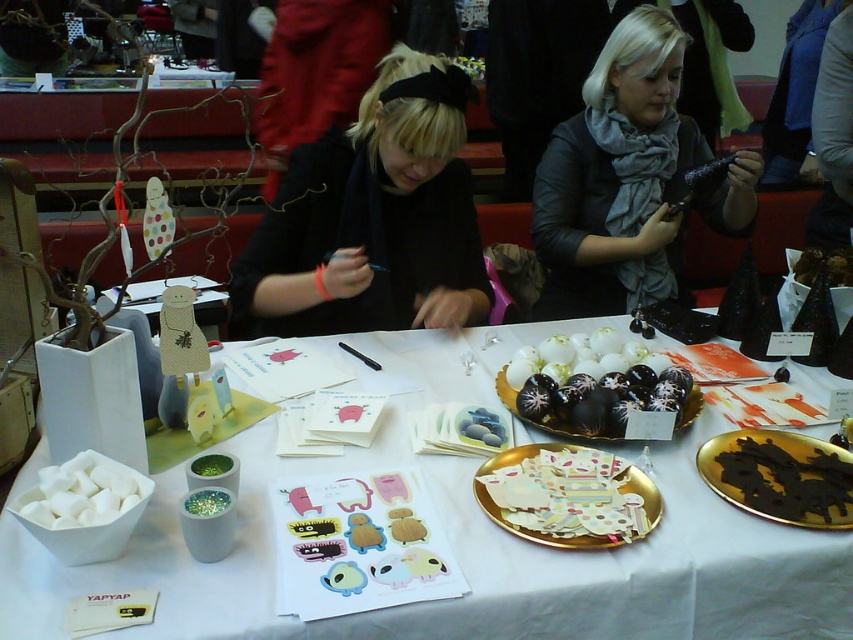
Question: Which point is closer to the camera taking this photo?

Choices:
 (A) (160, 550)
 (B) (70, 508)

Answer: (B)

Question: Can you confirm if white paper at center is positioned to the left of chocolate cake at center?

Choices:
 (A) yes
 (B) no

Answer: (A)

Question: Can you confirm if paper cutouts at center is bigger than shiny chocolate truffles at center?

Choices:
 (A) no
 (B) yes

Answer: (A)

Question: Can you confirm if gray scarf at upper center is positioned to the right of paper cutouts at center?

Choices:
 (A) yes
 (B) no

Answer: (A)

Question: Which point is closer to the camera?

Choices:
 (A) (657, 493)
 (B) (364, 460)
 (C) (383, 317)

Answer: (A)

Question: Which object is positioned farthest from the black glossy chocolate at lower right?

Choices:
 (A) shiny chocolate truffles at center
 (B) white paper at center

Answer: (B)